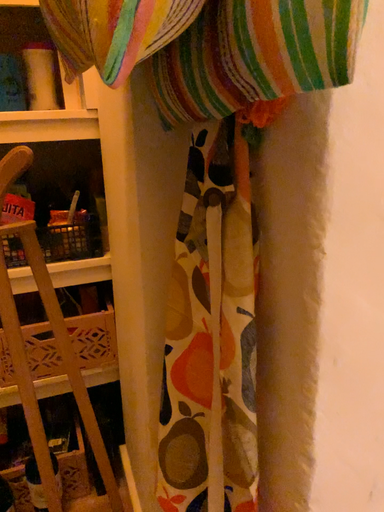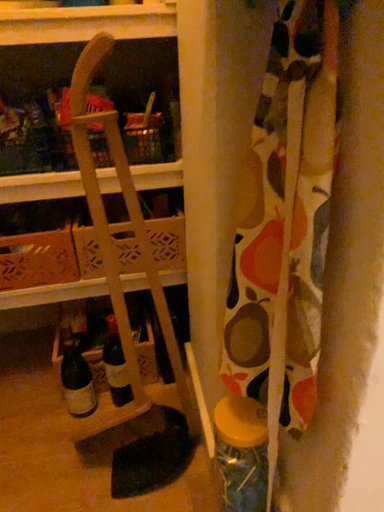
Question: How did the camera likely rotate when shooting the video?

Choices:
 (A) rotated right
 (B) rotated left

Answer: (B)